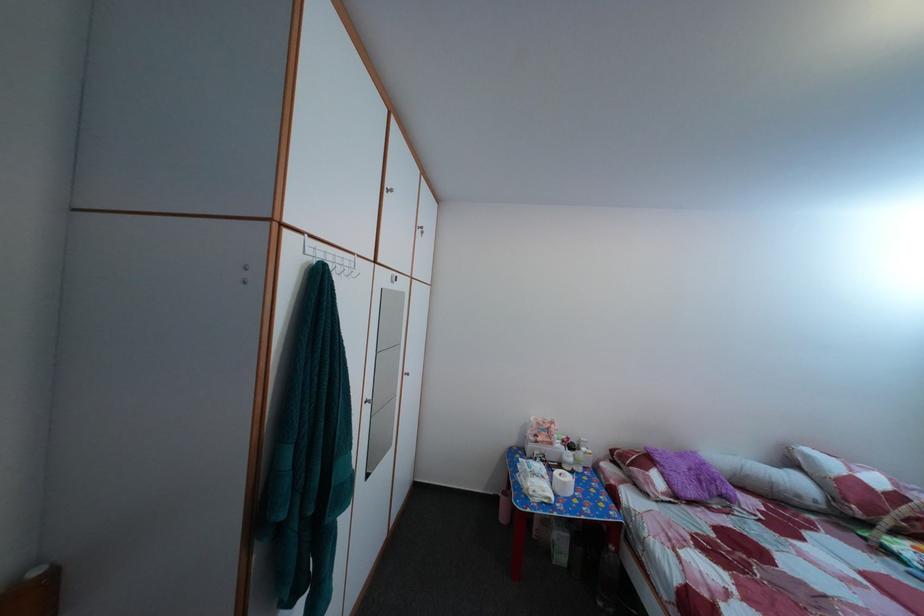
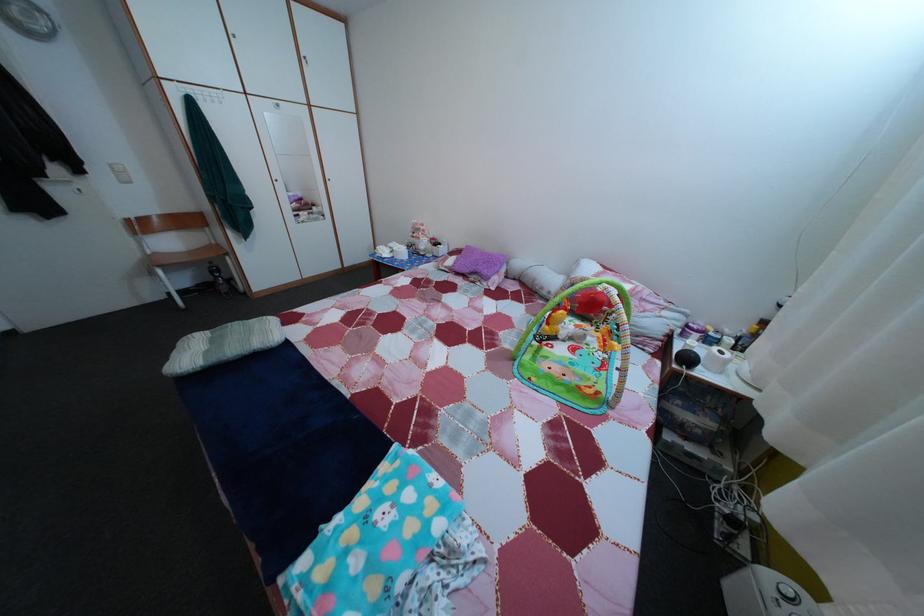
Find the pixel in the second image that matches point (689, 464) in the first image.

(492, 261)